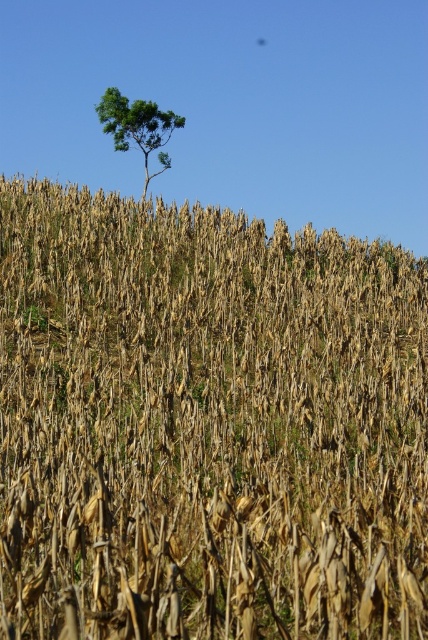
Question: Does brown dry stalks of corn at center have a lesser width compared to green leafy tree at upper center?

Choices:
 (A) no
 (B) yes

Answer: (A)

Question: Which of the following is the farthest from the observer?

Choices:
 (A) brown dry stalks of corn at center
 (B) green leafy tree at upper center

Answer: (B)

Question: Which point is farther to the camera?

Choices:
 (A) (112, 109)
 (B) (356, 317)

Answer: (A)

Question: Among these objects, which one is nearest to the camera?

Choices:
 (A) green leafy tree at upper center
 (B) brown dry stalks of corn at center

Answer: (B)

Question: Is brown dry stalks of corn at center smaller than green leafy tree at upper center?

Choices:
 (A) yes
 (B) no

Answer: (B)

Question: Is brown dry stalks of corn at center bigger than green leafy tree at upper center?

Choices:
 (A) yes
 (B) no

Answer: (A)